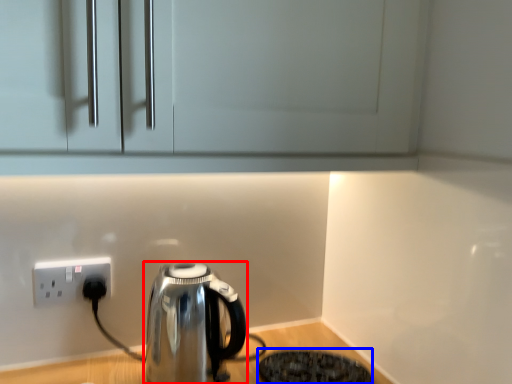
Question: Among these objects, which one is nearest to the camera, kettle (highlighted by a red box) or appliance (highlighted by a blue box)?

Choices:
 (A) kettle
 (B) appliance

Answer: (A)